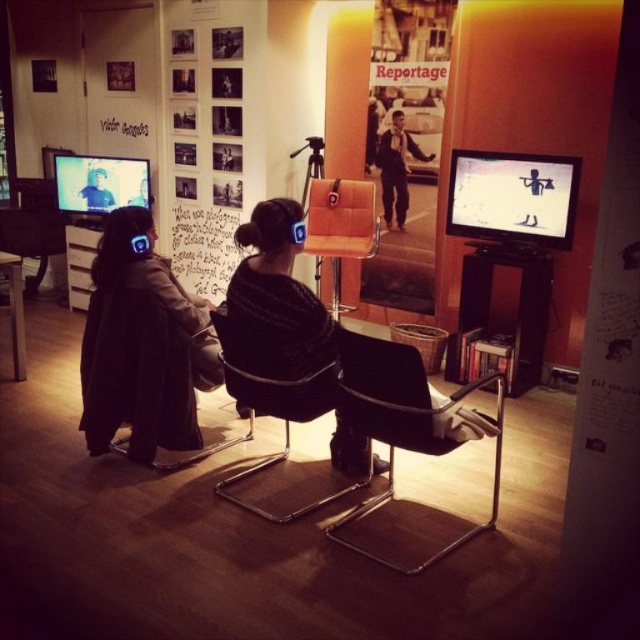
Measure the distance between dark brown leather jacket at left and camera.

dark brown leather jacket at left and camera are 2.90 meters apart.

Does dark brown leather jacket at left lie behind matte black chair at center?

That is True.

Is point (147, 376) farther from viewer compared to point (276, 198)?

Yes, it is behind point (276, 198).

What are the coordinates of `dark brown leather jacket at left` in the screenshot? It's located at (141, 346).

Who is shorter, black plastic swivel chair at center or black leather armchair at center?

Standing shorter between the two is black leather armchair at center.

Is black plastic swivel chair at center below black leather armchair at center?

Yes.

Is point (381, 497) positioned in front of point (282, 371)?

No, (381, 497) is further to viewer.

The height and width of the screenshot is (640, 640). In order to click on black plastic swivel chair at center in this screenshot , I will do `click(406, 420)`.

Is point (248, 396) positioned in front of point (97, 172)?

Yes, it is in front of point (97, 172).

Locate an element on the screen. This screenshot has height=640, width=640. black leather armchair at center is located at coordinates (273, 396).

In the scene shown: Who is more forward, (266, 348) or (90, 180)?

Point (266, 348)

This screenshot has width=640, height=640. In order to click on black leather armchair at center in this screenshot , I will do `click(273, 396)`.